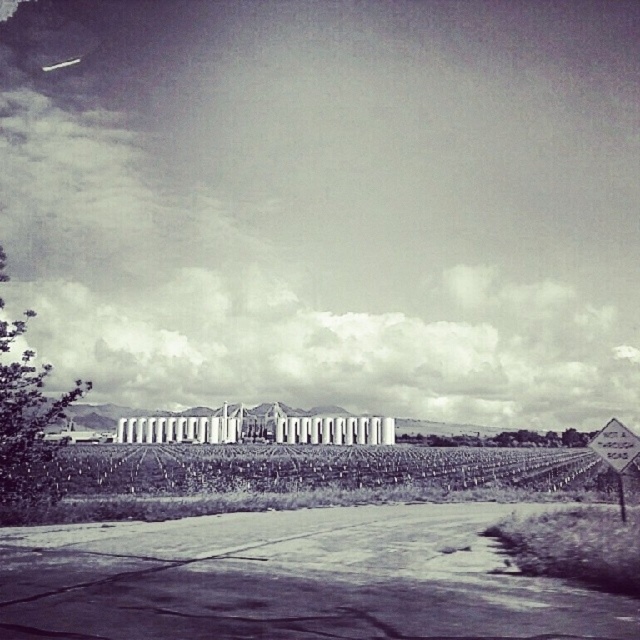
The width and height of the screenshot is (640, 640). I want to click on green grassy vineyard at center, so click(301, 477).

Does green grassy vineyard at center have a lesser height compared to metallic diamond-shaped sign at lower right?

Incorrect, green grassy vineyard at center's height does not fall short of metallic diamond-shaped sign at lower right's.

Find the location of a particular element. green grassy vineyard at center is located at coordinates (301, 477).